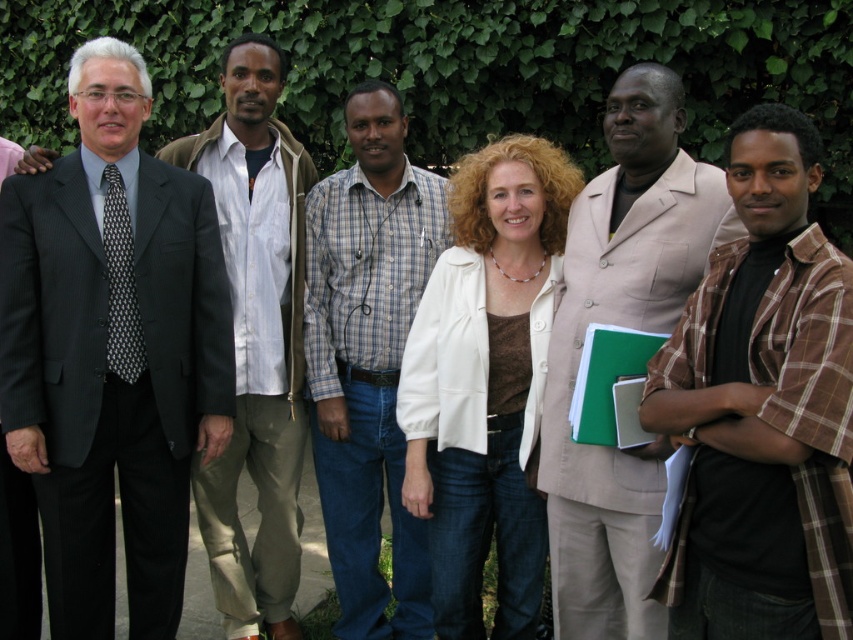
Is dark gray suit at left in front of plaid shirt at center?

That is True.

Who is positioned more to the left, dark gray suit at left or plaid shirt at center?

From the viewer's perspective, dark gray suit at left appears more on the left side.

You are a GUI agent. You are given a task and a screenshot of the screen. Output one action in this format:
    pyautogui.click(x=<x>, y=<y>)
    Task: Click on the dark gray suit at left
    The height and width of the screenshot is (640, 853).
    Given the screenshot: What is the action you would take?
    (x=112, y=352)

Between white leather jacket at center and beige fabric suit at center, which one appears on the right side from the viewer's perspective?

Positioned to the right is beige fabric suit at center.

Does white leather jacket at center have a smaller size compared to beige fabric suit at center?

Correct, white leather jacket at center occupies less space than beige fabric suit at center.

Measure the distance between point (480,365) and camera.

A distance of 3.84 meters exists between point (480,365) and camera.

You are a GUI agent. You are given a task and a screenshot of the screen. Output one action in this format:
    pyautogui.click(x=<x>, y=<y>)
    Task: Click on the white leather jacket at center
    This screenshot has width=853, height=640.
    Given the screenshot: What is the action you would take?
    pyautogui.click(x=485, y=381)

Does brown plaid shirt at center come in front of white leather jacket at center?

Yes, it is in front of white leather jacket at center.

Can you confirm if brown plaid shirt at center is shorter than white leather jacket at center?

Indeed, brown plaid shirt at center has a lesser height compared to white leather jacket at center.

Which is in front, point (850, 292) or point (531, 442)?

Point (850, 292) is in front.

You are a GUI agent. You are given a task and a screenshot of the screen. Output one action in this format:
    pyautogui.click(x=<x>, y=<y>)
    Task: Click on the brown plaid shirt at center
    The image size is (853, 640).
    Given the screenshot: What is the action you would take?
    pyautogui.click(x=762, y=408)